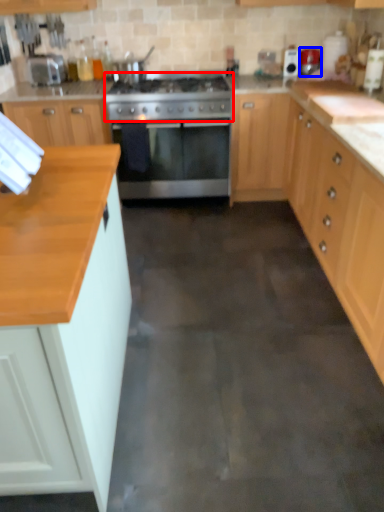
Question: Among these objects, which one is farthest to the camera, gas stove (highlighted by a red box) or appliance (highlighted by a blue box)?

Choices:
 (A) gas stove
 (B) appliance

Answer: (B)